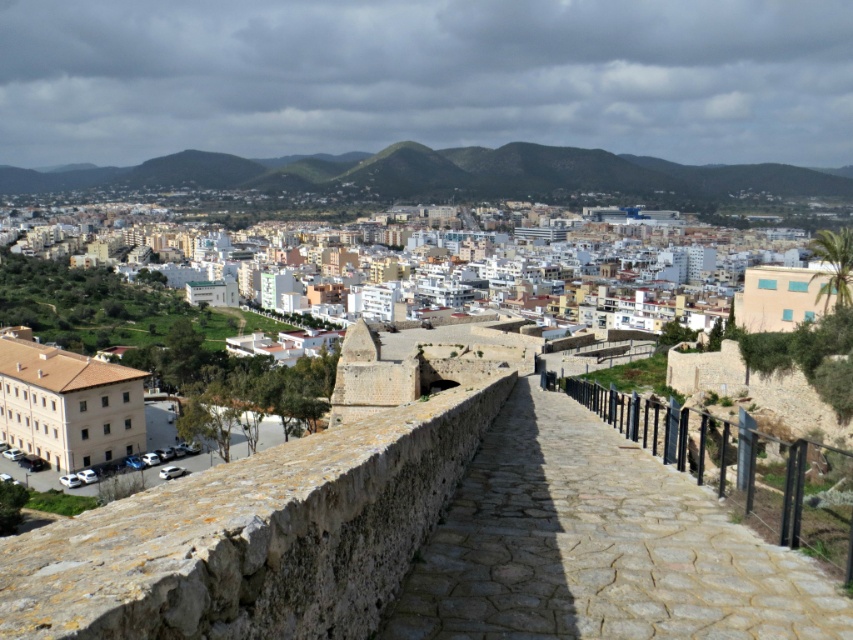
You are a tour guide leading a group along the stone paved pathway at center and pointing out the brown stone building at lower left. Can you confirm if the pathway is wider than the building?

The stone paved pathway at center has a lesser width compared to brown stone building at lower left, so the pathway is narrower than the building.

You are standing at the elevated viewpoint overlooking the city. You notice two points marked in the image. The first point is at coordinates point (x=570, y=636) and the second is at point (x=328, y=164). Which of these two points is nearer to your current position?

Point (x=570, y=636) is closer to the viewer than point (x=328, y=164).